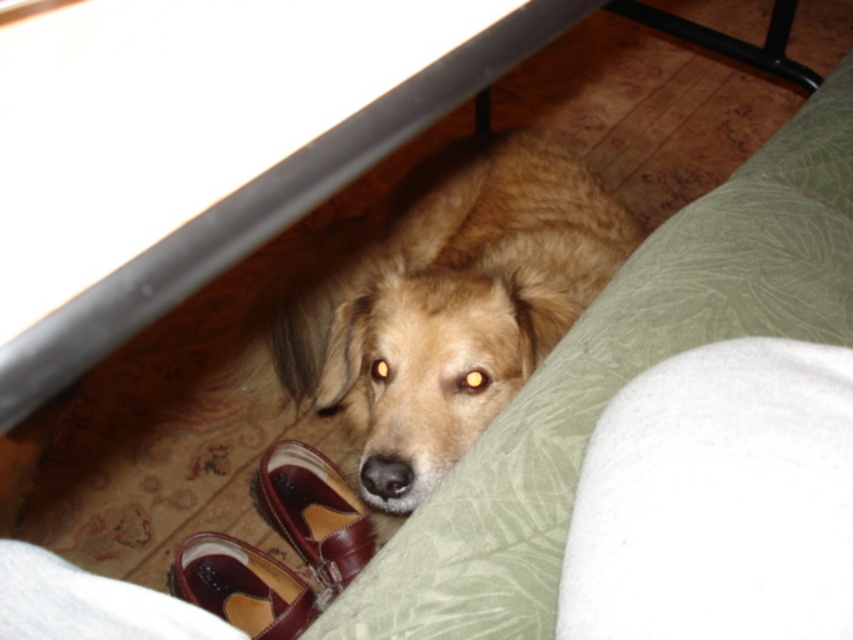
Locate an element on the screen. This screenshot has width=853, height=640. golden fur dog at center is located at coordinates (450, 305).

Is point (461, 157) positioned after point (303, 451)?

That is True.

Measure the distance between golden fur dog at center and camera.

A distance of 34.24 inches exists between golden fur dog at center and camera.

I want to click on golden fur dog at center, so click(450, 305).